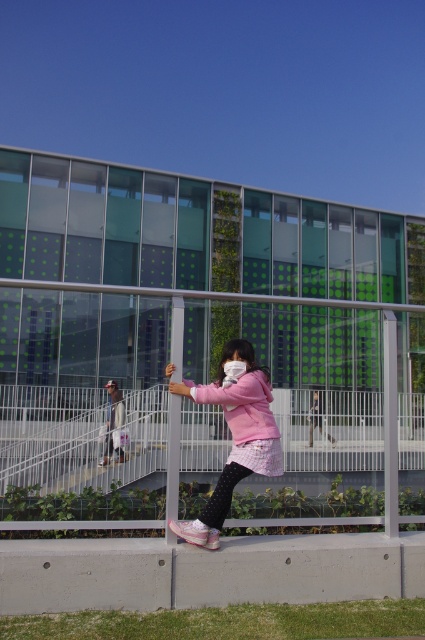
Which is above, pink matte jacket at center or light pink fabric jacket at center?

pink matte jacket at center is above.

Is pink matte jacket at center thinner than light pink fabric jacket at center?

In fact, pink matte jacket at center might be wider than light pink fabric jacket at center.

Who is more forward, (260,449) or (115,422)?

Point (260,449) is in front.

I want to click on pink matte jacket at center, so click(234, 435).